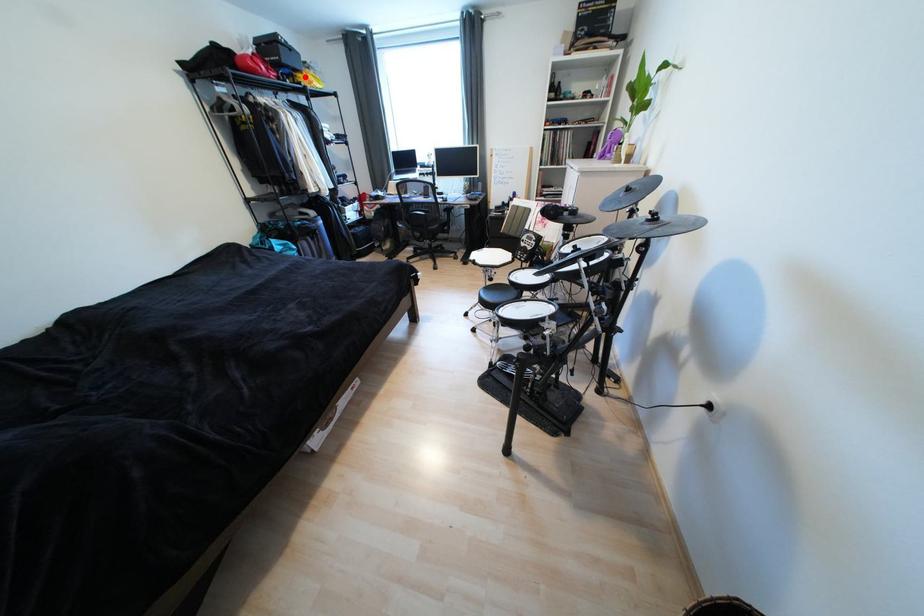
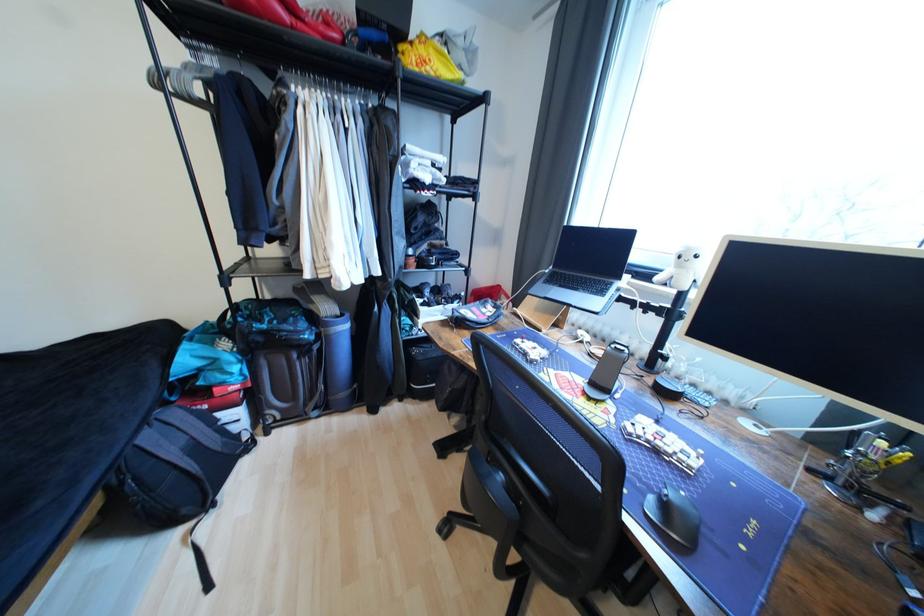
In the second image, find the point that corresponds to the highlighted location in the first image.

(407, 49)